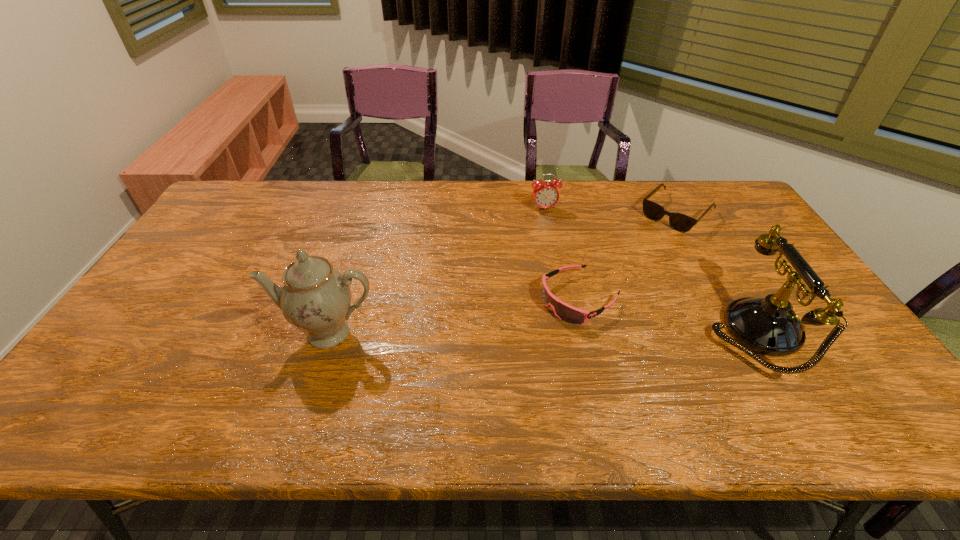
The height and width of the screenshot is (540, 960). What are the coordinates of `free space located 0.250m on the front-facing side of the goggles` in the screenshot? It's located at (471, 357).

Where is `free location located 0.070m on the front-facing side of the goggles`? This screenshot has width=960, height=540. free location located 0.070m on the front-facing side of the goggles is located at coordinates tap(529, 325).

At what (x,y) coordinates should I click in order to perform the action: click on free space located on the face of the alarm clock. Please return your answer as a coordinate pair (x, y). Looking at the image, I should click on (561, 254).

Where is `free location located 0.140m on the face of the alarm clock`? Image resolution: width=960 pixels, height=540 pixels. free location located 0.140m on the face of the alarm clock is located at coordinates tap(555, 238).

Locate an element on the screen. The width and height of the screenshot is (960, 540). free space located 0.240m on the face of the alarm clock is located at coordinates (563, 258).

The height and width of the screenshot is (540, 960). What are the coordinates of `sunglasses located at the far edge` in the screenshot? It's located at (680, 222).

Where is `alarm clock positioned at the far edge`? alarm clock positioned at the far edge is located at coordinates (545, 194).

You are a GUI agent. You are given a task and a screenshot of the screen. Output one action in this format:
    pyautogui.click(x=<x>, y=<y>)
    Task: Click on the chinaware located in the near edge section of the desktop
    The image size is (960, 540).
    Given the screenshot: What is the action you would take?
    pyautogui.click(x=316, y=298)

Image resolution: width=960 pixels, height=540 pixels. Identify the location of telephone present at the near edge. (769, 326).

The image size is (960, 540). I want to click on telephone present at the right edge, so click(x=769, y=326).